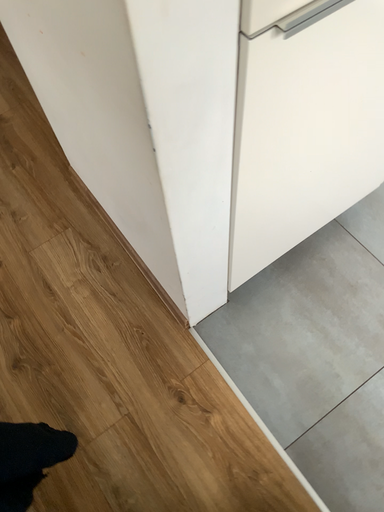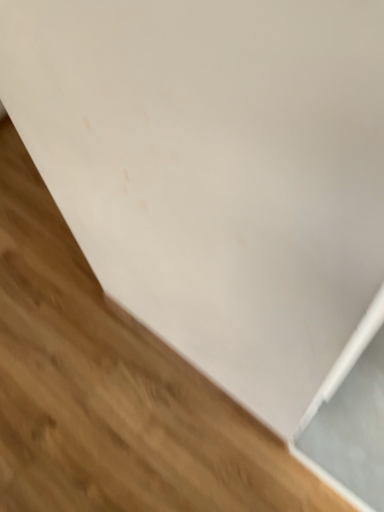
Question: How did the camera likely rotate when shooting the video?

Choices:
 (A) rotated upward
 (B) rotated downward

Answer: (A)